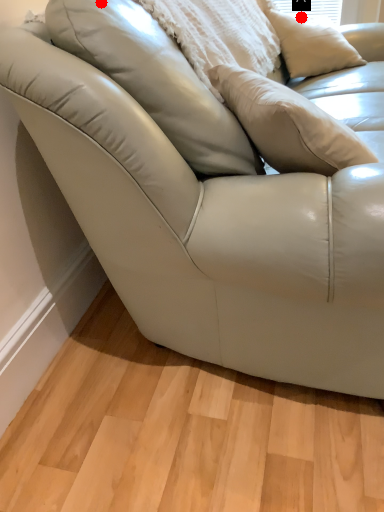
Question: Two points are circled on the image, labeled by A and B beside each circle. Among these points, which one is nearest to the camera?

Choices:
 (A) A is closer
 (B) B is closer

Answer: (B)